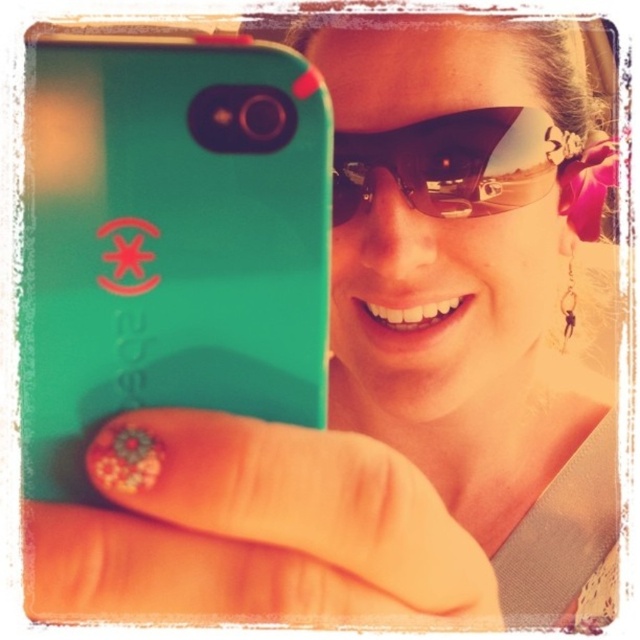
You are a photographer trying to capture the teal rubberized phone at center and the glittery nail art at center in a photo. Which object should you focus on first if you want to ensure both are in sharp focus, considering their sizes?

The teal rubberized phone at center is taller than the glittery nail art at center, so focusing on the larger object first will help ensure both are in sharp focus.